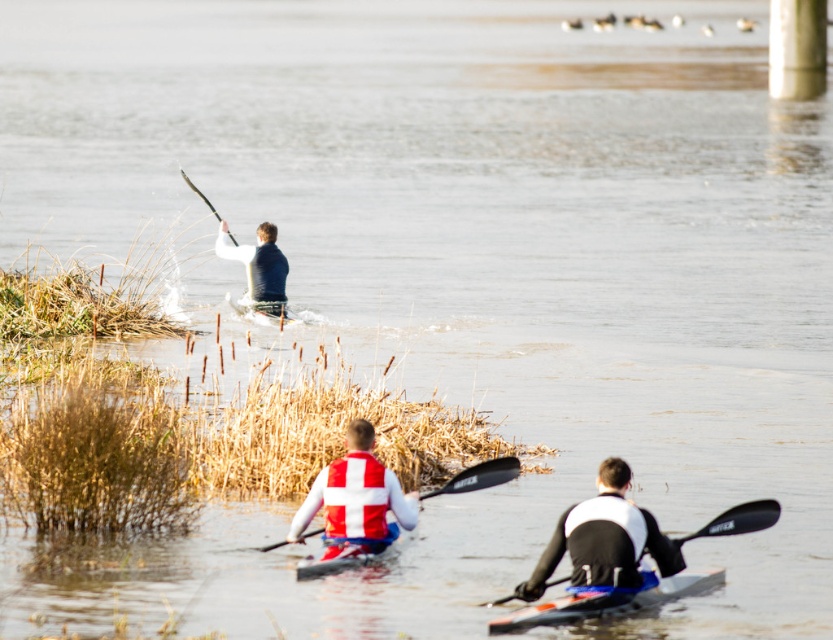
Between black matte wetsuit at lower right and white plastic canoe at center, which one has less height?

Standing shorter between the two is white plastic canoe at center.

Is black matte wetsuit at lower right taller than white plastic canoe at center?

Indeed, black matte wetsuit at lower right has a greater height compared to white plastic canoe at center.

Find the location of a particular element. black matte wetsuit at lower right is located at coordinates (604, 538).

At what (x,y) coordinates should I click in order to perform the action: click on black matte wetsuit at lower right. Please return your answer as a coordinate pair (x, y). The image size is (833, 640). Looking at the image, I should click on (604, 538).

Is white matte life jacket at center positioned at the back of black plastic paddle at lower center?

Yes, it is.

Is white matte life jacket at center to the right of black plastic paddle at lower center from the viewer's perspective?

Incorrect, white matte life jacket at center is not on the right side of black plastic paddle at lower center.

Between point (360, 477) and point (776, 520), which one is positioned behind?

Positioned behind is point (360, 477).

This screenshot has width=833, height=640. I want to click on white matte life jacket at center, so click(x=355, y=497).

At what (x,y) coordinates should I click in order to perform the action: click on black matte wetsuit at lower right. Please return your answer as a coordinate pair (x, y). Image resolution: width=833 pixels, height=640 pixels. Looking at the image, I should click on (604, 538).

Is black matte wetsuit at lower right wider than matte black kayak at upper left?

Yes.

Does point (532, 595) lie in front of point (243, 253)?

Yes, point (532, 595) is closer to viewer.

Locate an element on the screen. The height and width of the screenshot is (640, 833). black matte wetsuit at lower right is located at coordinates (604, 538).